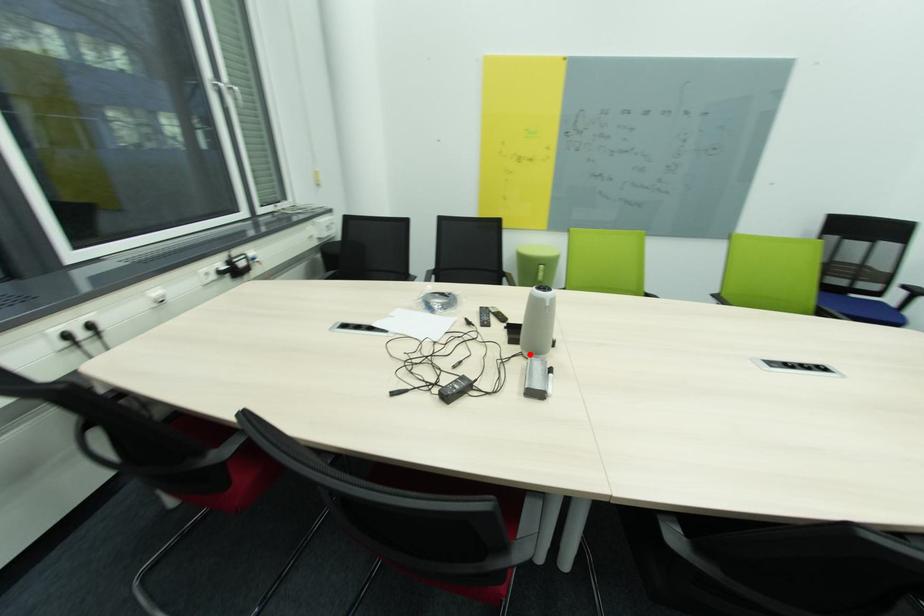
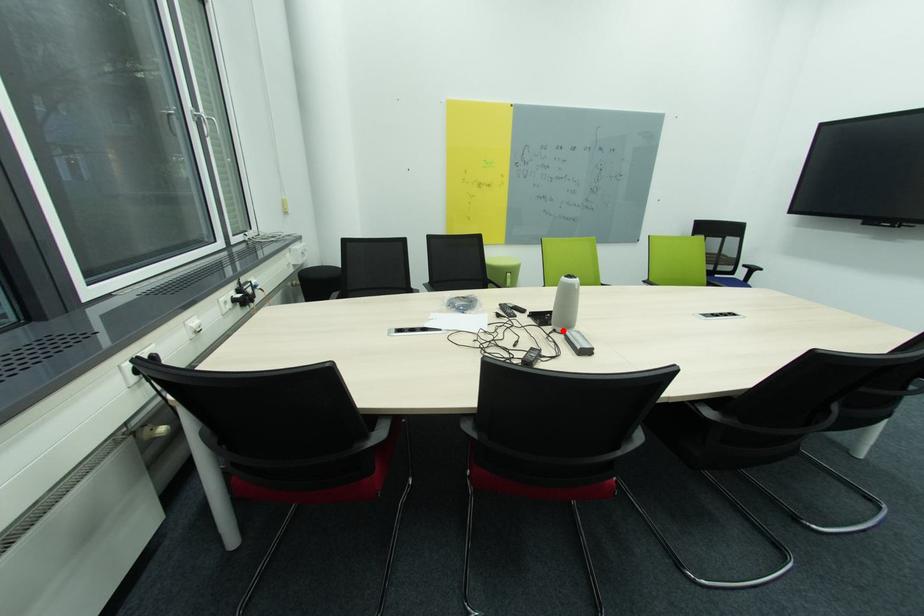
I am providing you with two images of the same scene from different viewpoints. A red point is marked on the first image and another point is marked on the second image. Does the point marked in image1 correspond to the same location as the one in image2?

Yes